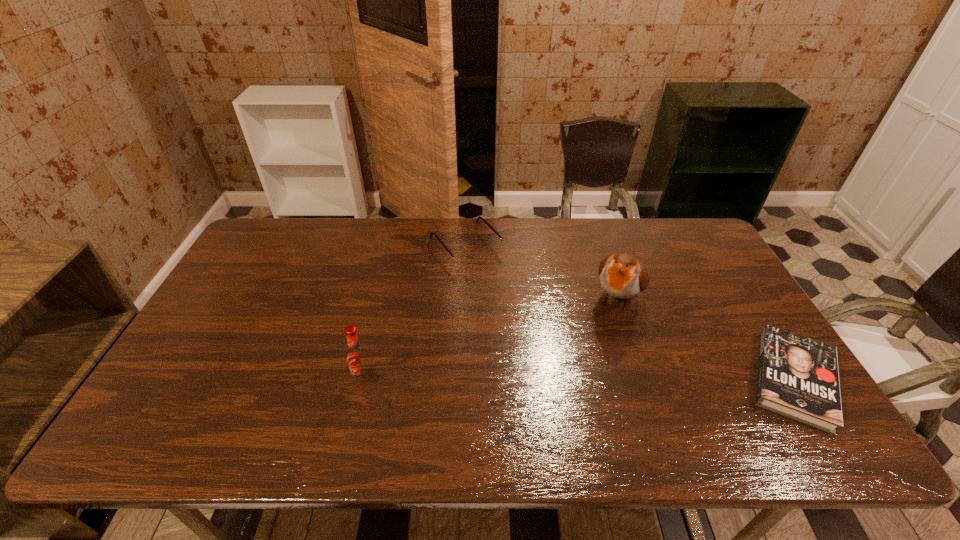
The width and height of the screenshot is (960, 540). In order to click on root beer in this screenshot , I will do `click(358, 358)`.

In order to click on the shortest object in this screenshot , I will do `click(798, 377)`.

At what (x,y) coordinates should I click in order to perform the action: click on book. Please return your answer as a coordinate pair (x, y). The height and width of the screenshot is (540, 960). Looking at the image, I should click on (798, 377).

You are a GUI agent. You are given a task and a screenshot of the screen. Output one action in this format:
    pyautogui.click(x=<x>, y=<y>)
    Task: Click on the bird
    
    Given the screenshot: What is the action you would take?
    pyautogui.click(x=622, y=276)

You are a GUI agent. You are given a task and a screenshot of the screen. Output one action in this format:
    pyautogui.click(x=<x>, y=<y>)
    Task: Click on the third nearest object
    This screenshot has height=540, width=960.
    Given the screenshot: What is the action you would take?
    pyautogui.click(x=622, y=276)

Identify the location of the third tallest object. (466, 257).

The height and width of the screenshot is (540, 960). In order to click on the third object from right to left in this screenshot , I will do `click(466, 257)`.

Locate an element on the screen. The height and width of the screenshot is (540, 960). vacant space located 0.100m on the left of the root beer is located at coordinates (315, 380).

You are a GUI agent. You are given a task and a screenshot of the screen. Output one action in this format:
    pyautogui.click(x=<x>, y=<y>)
    Task: Click on the free space located on the back of the rightmost object
    Image resolution: width=960 pixels, height=540 pixels.
    Given the screenshot: What is the action you would take?
    pyautogui.click(x=733, y=282)

The width and height of the screenshot is (960, 540). I want to click on free space located at the face of the second farthest object, so click(x=594, y=353).